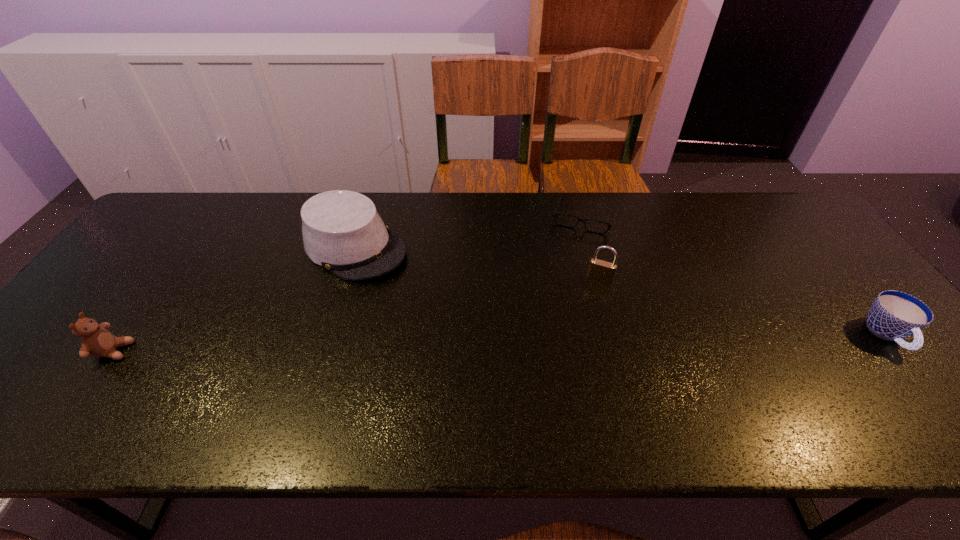
This screenshot has width=960, height=540. I want to click on free region located on the front-facing side of the padlock, so click(565, 374).

Where is `vacant region located 0.280m on the front-facing side of the hat`? The height and width of the screenshot is (540, 960). vacant region located 0.280m on the front-facing side of the hat is located at coordinates (468, 319).

Image resolution: width=960 pixels, height=540 pixels. I want to click on vacant space located 0.340m on the front-facing side of the hat, so point(487,330).

Where is `vacant space located on the front-facing side of the hat`? vacant space located on the front-facing side of the hat is located at coordinates pyautogui.click(x=474, y=322).

Locate an element on the screen. vacant space located on the front-facing side of the shortest object is located at coordinates (569, 264).

The image size is (960, 540). Find the location of `free region located on the front-facing side of the shortest object`. free region located on the front-facing side of the shortest object is located at coordinates [x=572, y=253].

Where is `vacant space positioned on the front-facing side of the shortest object`? This screenshot has width=960, height=540. vacant space positioned on the front-facing side of the shortest object is located at coordinates (562, 288).

Locate an element on the screen. hat at the far edge is located at coordinates (342, 231).

Find the location of a particular element. This screenshot has width=960, height=540. spectacles that is positioned at the far edge is located at coordinates (555, 214).

Where is `object located at the near edge`? Image resolution: width=960 pixels, height=540 pixels. object located at the near edge is located at coordinates 96,341.